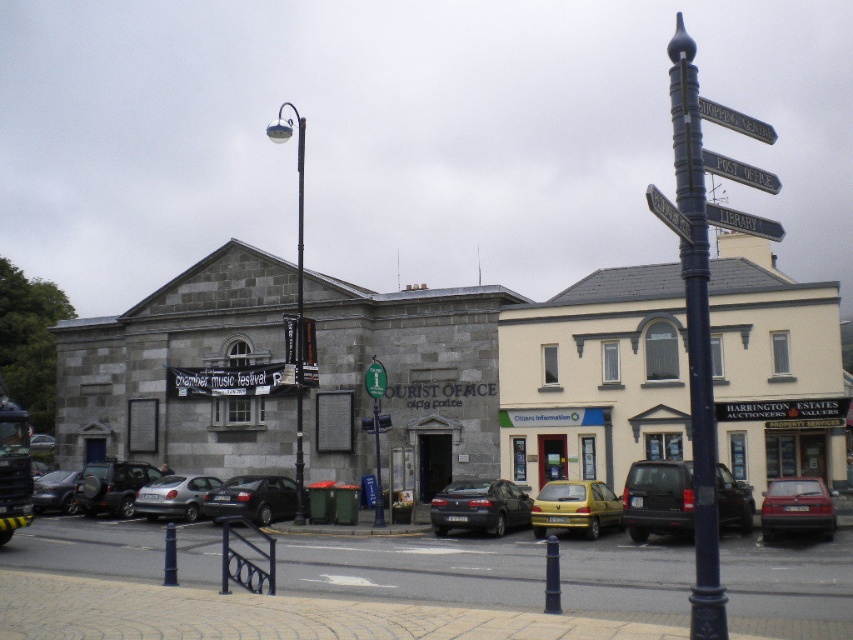
Is matte black car at center shorter than silver metallic hatchback at center?

Indeed, matte black car at center has a lesser height compared to silver metallic hatchback at center.

Find the location of a particular element. This screenshot has height=640, width=853. matte black car at center is located at coordinates (479, 506).

Measure the distance between point (x=479, y=525) and camera.

They are 26.74 meters apart.

Find the location of a particular element. Image resolution: width=853 pixels, height=640 pixels. matte black car at center is located at coordinates (479, 506).

Is the position of metallic yellow car at center more distant than that of metallic silver suv at center-left?

No, it is in front of metallic silver suv at center-left.

Is metallic yellow car at center closer to camera compared to metallic silver suv at center-left?

Yes, it is in front of metallic silver suv at center-left.

The width and height of the screenshot is (853, 640). What do you see at coordinates (575, 508) in the screenshot?
I see `metallic yellow car at center` at bounding box center [575, 508].

Where is `metallic yellow car at center`? Image resolution: width=853 pixels, height=640 pixels. metallic yellow car at center is located at coordinates (575, 508).

Can you confirm if silver metallic hatchback at center is wider than metallic signpost at upper center?

No.

Who is more distant from viewer, (177, 486) or (697, 99)?

The point (177, 486) is behind.

Who is more forward, (207, 488) or (720, 120)?

Point (720, 120) is more forward.

Find the location of a particular element. This screenshot has width=853, height=640. silver metallic hatchback at center is located at coordinates (173, 497).